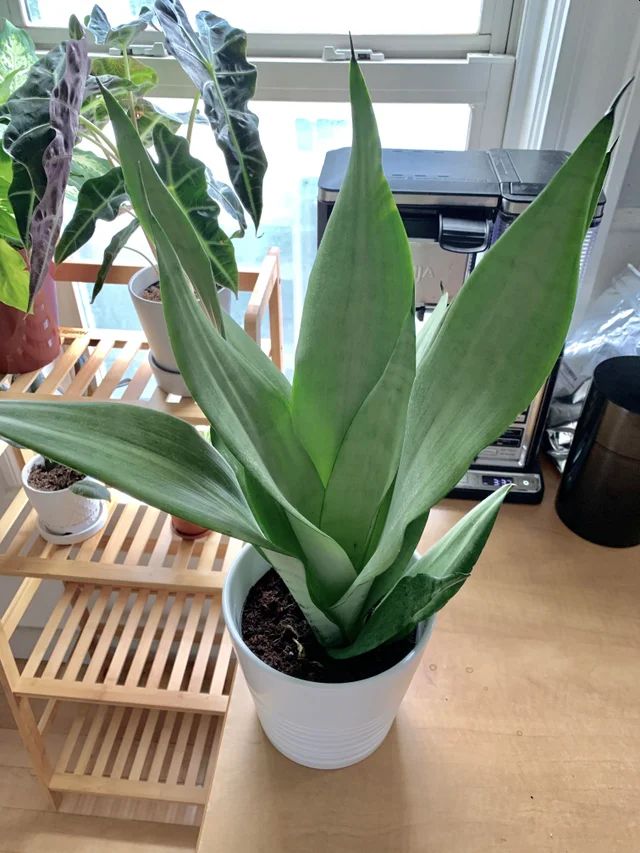
The width and height of the screenshot is (640, 853). Identify the location of brown shelves. (131, 573), (108, 683), (104, 780).